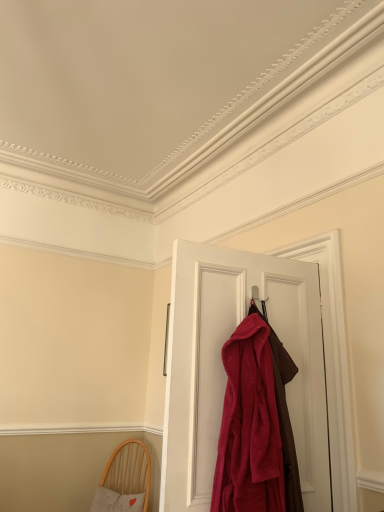
Question: Is velvet red robe at center located within light wood chair with cushion at lower left?

Choices:
 (A) yes
 (B) no

Answer: (B)

Question: From the image's perspective, is light wood chair with cushion at lower left above velvet red robe at center?

Choices:
 (A) yes
 (B) no

Answer: (B)

Question: Can you confirm if light wood chair with cushion at lower left is positioned to the right of velvet red robe at center?

Choices:
 (A) yes
 (B) no

Answer: (B)

Question: Can you confirm if light wood chair with cushion at lower left is smaller than velvet red robe at center?

Choices:
 (A) yes
 (B) no

Answer: (B)

Question: Is light wood chair with cushion at lower left further to camera compared to velvet red robe at center?

Choices:
 (A) yes
 (B) no

Answer: (A)

Question: Considering the positions of velvet red robe at center and velvety red robe at center in the image, is velvet red robe at center wider or thinner than velvety red robe at center?

Choices:
 (A) wide
 (B) thin

Answer: (B)

Question: Based on their sizes in the image, would you say velvet red robe at center is bigger or smaller than velvety red robe at center?

Choices:
 (A) big
 (B) small

Answer: (A)

Question: Relative to velvety red robe at center, is velvet red robe at center in front or behind?

Choices:
 (A) front
 (B) behind

Answer: (B)

Question: Based on their positions, is velvet red robe at center located to the left or right of velvety red robe at center?

Choices:
 (A) right
 (B) left

Answer: (A)

Question: Is point (256, 307) closer or farther from the camera than point (288, 302)?

Choices:
 (A) closer
 (B) farther

Answer: (A)

Question: From a real-world perspective, relative to velvet red robe at center, is velvety red robe at center vertically above or below?

Choices:
 (A) above
 (B) below

Answer: (B)

Question: Considering their positions, is velvety red robe at center located in front of or behind velvet red robe at center?

Choices:
 (A) behind
 (B) front

Answer: (B)

Question: Based on their sizes in the image, would you say velvety red robe at center is bigger or smaller than velvet red robe at center?

Choices:
 (A) small
 (B) big

Answer: (A)

Question: Considering the positions of light wood chair with cushion at lower left and velvet red robe at center in the image, is light wood chair with cushion at lower left bigger or smaller than velvet red robe at center?

Choices:
 (A) big
 (B) small

Answer: (A)

Question: Is point (125, 504) positioned closer to the camera than point (208, 382)?

Choices:
 (A) farther
 (B) closer

Answer: (A)